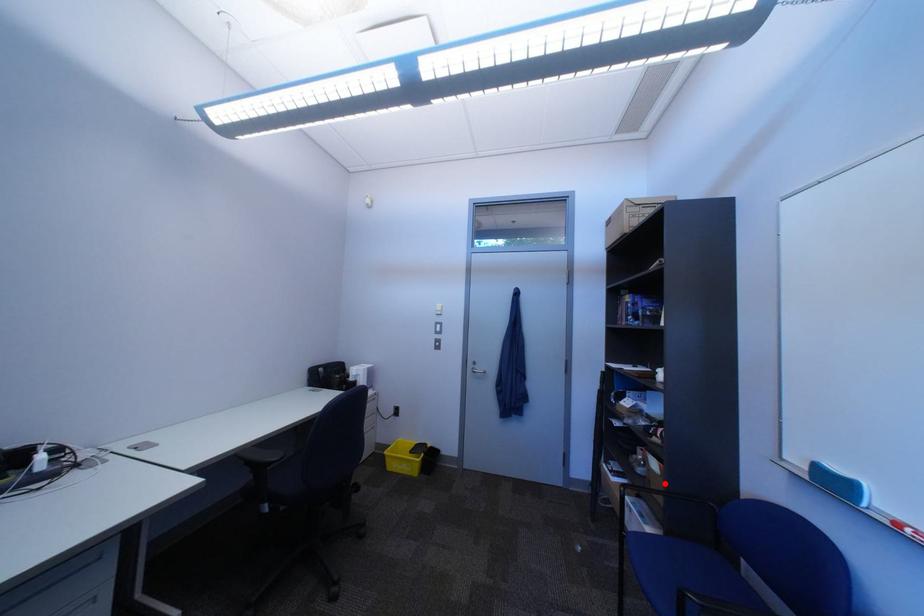
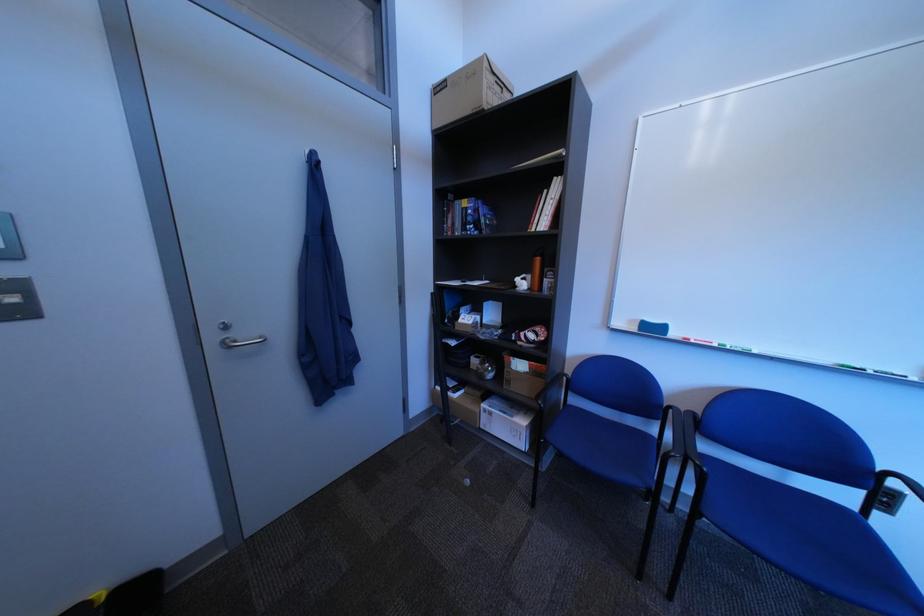
Question: I am providing you with two images of the same scene from different viewpoints. A red point is marked on the first image. Can you still see the location of the red point in image 2?

Choices:
 (A) Yes
 (B) No

Answer: (A)